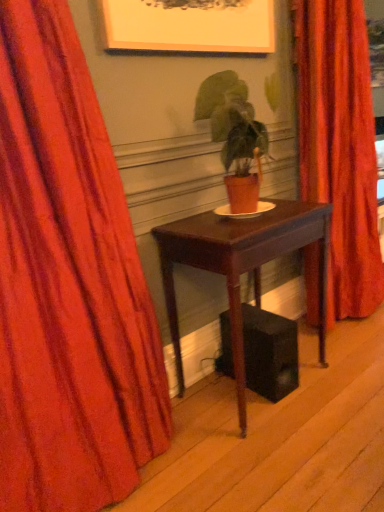
Question: From the image's perspective, is velvet red curtain at left, which is counted as the second curtain, starting from the right, located beneath mahogany wood table at center?

Choices:
 (A) no
 (B) yes

Answer: (A)

Question: Considering the relative sizes of velvet red curtain at left, which ranks as the first curtain in front-to-back order, and mahogany wood table at center in the image provided, is velvet red curtain at left, which ranks as the first curtain in front-to-back order, wider than mahogany wood table at center?

Choices:
 (A) no
 (B) yes

Answer: (A)

Question: Is velvet red curtain at left, which ranks as the first curtain in front-to-back order, beside mahogany wood table at center?

Choices:
 (A) no
 (B) yes

Answer: (A)

Question: Is velvet red curtain at left, which ranks as the 1th curtain in left-to-right order, taller than mahogany wood table at center?

Choices:
 (A) no
 (B) yes

Answer: (B)

Question: From the image's perspective, is velvet red curtain at left, acting as the 2th curtain starting from the back, above mahogany wood table at center?

Choices:
 (A) yes
 (B) no

Answer: (A)

Question: Is velvet red curtain at left, which is counted as the second curtain, starting from the right, thinner than mahogany wood table at center?

Choices:
 (A) yes
 (B) no

Answer: (A)

Question: From the image's perspective, is velvet orange curtain at center, the 2th curtain from the left, under velvet red curtain at left, which ranks as the first curtain in front-to-back order?

Choices:
 (A) no
 (B) yes

Answer: (A)

Question: From a real-world perspective, is velvet orange curtain at center, marked as the 2th curtain in a front-to-back arrangement, physically below velvet red curtain at left, which ranks as the first curtain in front-to-back order?

Choices:
 (A) yes
 (B) no

Answer: (B)

Question: Considering the relative sizes of velvet orange curtain at center, which ranks as the first curtain in right-to-left order, and velvet red curtain at left, which ranks as the first curtain in front-to-back order, in the image provided, is velvet orange curtain at center, which ranks as the first curtain in right-to-left order, taller than velvet red curtain at left, which ranks as the first curtain in front-to-back order,?

Choices:
 (A) yes
 (B) no

Answer: (A)

Question: Is the depth of velvet orange curtain at center, which ranks as the 1th curtain in back-to-front order, less than that of velvet red curtain at left, which ranks as the first curtain in front-to-back order?

Choices:
 (A) yes
 (B) no

Answer: (B)

Question: Is velvet orange curtain at center, which ranks as the 1th curtain in back-to-front order, positioned behind velvet red curtain at left, acting as the 2th curtain starting from the back?

Choices:
 (A) yes
 (B) no

Answer: (A)

Question: Considering the relative positions of velvet orange curtain at center, which ranks as the 1th curtain in back-to-front order, and velvet red curtain at left, which is counted as the second curtain, starting from the right, in the image provided, is velvet orange curtain at center, which ranks as the 1th curtain in back-to-front order, to the left of velvet red curtain at left, which is counted as the second curtain, starting from the right, from the viewer's perspective?

Choices:
 (A) no
 (B) yes

Answer: (A)

Question: Considering the relative sizes of mahogany wood table at center and velvet orange curtain at center, the 2th curtain from the left, in the image provided, is mahogany wood table at center thinner than velvet orange curtain at center, the 2th curtain from the left,?

Choices:
 (A) yes
 (B) no

Answer: (B)